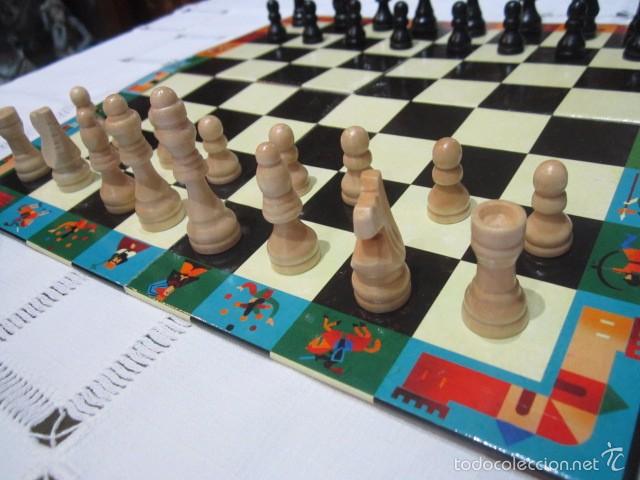
The height and width of the screenshot is (480, 640). I want to click on table covering, so click(196, 25).